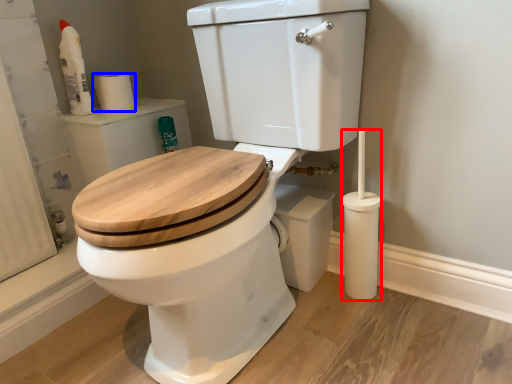
Question: Which of the following is the farthest to the observer, brush (highlighted by a red box) or toilet paper (highlighted by a blue box)?

Choices:
 (A) brush
 (B) toilet paper

Answer: (B)